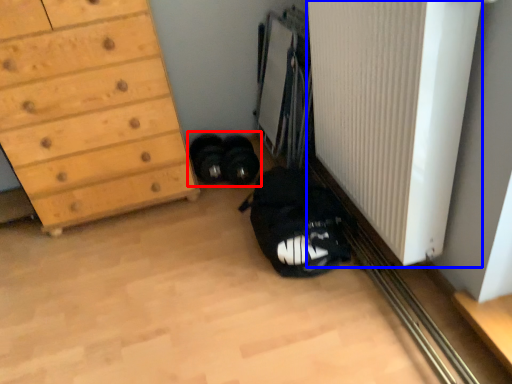
Question: Among these objects, which one is nearest to the camera, footwear (highlighted by a red box) or radiator (highlighted by a blue box)?

Choices:
 (A) footwear
 (B) radiator

Answer: (B)